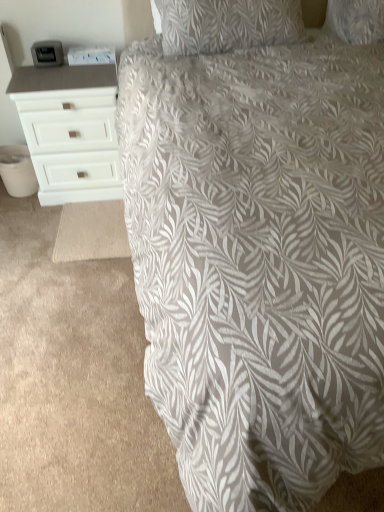
Question: From the image's perspective, would you say white matte chest of drawers at left is positioned over gray leaf-patterned fabric at center?

Choices:
 (A) no
 (B) yes

Answer: (B)

Question: From a real-world perspective, is white matte chest of drawers at left physically above gray leaf-patterned fabric at center?

Choices:
 (A) yes
 (B) no

Answer: (A)

Question: Is gray leaf-patterned fabric at center at the back of white matte chest of drawers at left?

Choices:
 (A) no
 (B) yes

Answer: (A)

Question: Could you tell me if white matte chest of drawers at left is turned towards gray leaf-patterned fabric at center?

Choices:
 (A) no
 (B) yes

Answer: (B)

Question: Can gray leaf-patterned fabric at center be found inside white matte chest of drawers at left?

Choices:
 (A) yes
 (B) no

Answer: (B)

Question: Considering the relative sizes of white matte chest of drawers at left and gray leaf-patterned fabric at center in the image provided, is white matte chest of drawers at left bigger than gray leaf-patterned fabric at center?

Choices:
 (A) yes
 (B) no

Answer: (B)

Question: Considering the relative positions of gray leaf-patterned fabric at center and white matte chest of drawers at left in the image provided, is gray leaf-patterned fabric at center in front of white matte chest of drawers at left?

Choices:
 (A) no
 (B) yes

Answer: (B)

Question: Considering the relative sizes of gray leaf-patterned fabric at center and white matte chest of drawers at left in the image provided, is gray leaf-patterned fabric at center smaller than white matte chest of drawers at left?

Choices:
 (A) no
 (B) yes

Answer: (A)

Question: Is gray leaf-patterned fabric at center oriented away from white matte chest of drawers at left?

Choices:
 (A) yes
 (B) no

Answer: (B)

Question: Considering the relative sizes of gray leaf-patterned fabric at center and white matte chest of drawers at left in the image provided, is gray leaf-patterned fabric at center thinner than white matte chest of drawers at left?

Choices:
 (A) yes
 (B) no

Answer: (B)

Question: From the image's perspective, does gray leaf-patterned fabric at center appear higher than white matte chest of drawers at left?

Choices:
 (A) no
 (B) yes

Answer: (A)

Question: Considering the relative sizes of gray leaf-patterned fabric at center and white matte chest of drawers at left in the image provided, is gray leaf-patterned fabric at center shorter than white matte chest of drawers at left?

Choices:
 (A) yes
 (B) no

Answer: (A)

Question: From the image's perspective, relative to gray leaf-patterned fabric at center, is white matte chest of drawers at left above or below?

Choices:
 (A) below
 (B) above

Answer: (B)